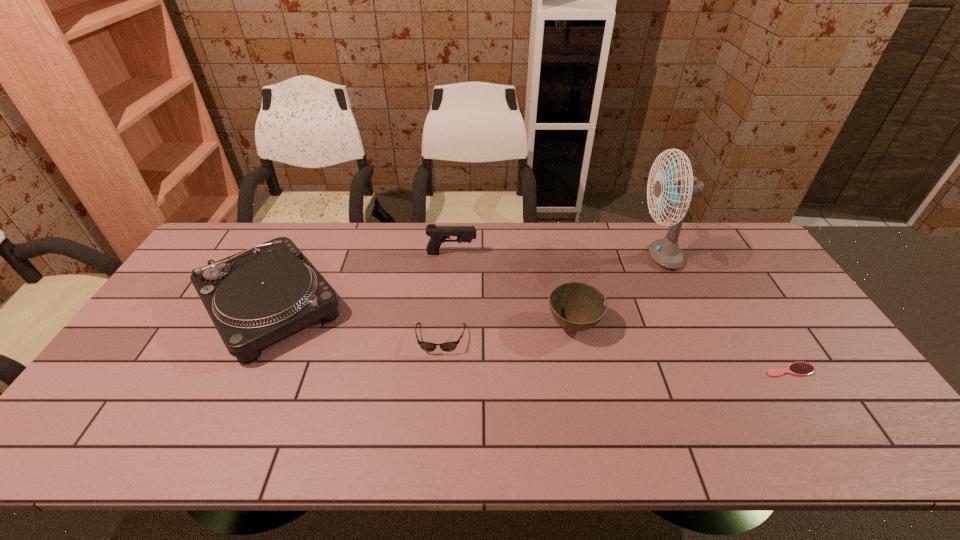
At what (x,y) coordinates should I click in order to perform the action: click on vacant area that satisfies the following two spatial constraints: 1. on the front side of the hairbrush; 2. on the left side of the record player. Please return your answer as a coordinate pair (x, y). Looking at the image, I should click on (238, 370).

Identify the location of free point that satisfies the following two spatial constraints: 1. on the front-facing side of the second object from right to left; 2. on the left side of the rightmost object. (713, 370).